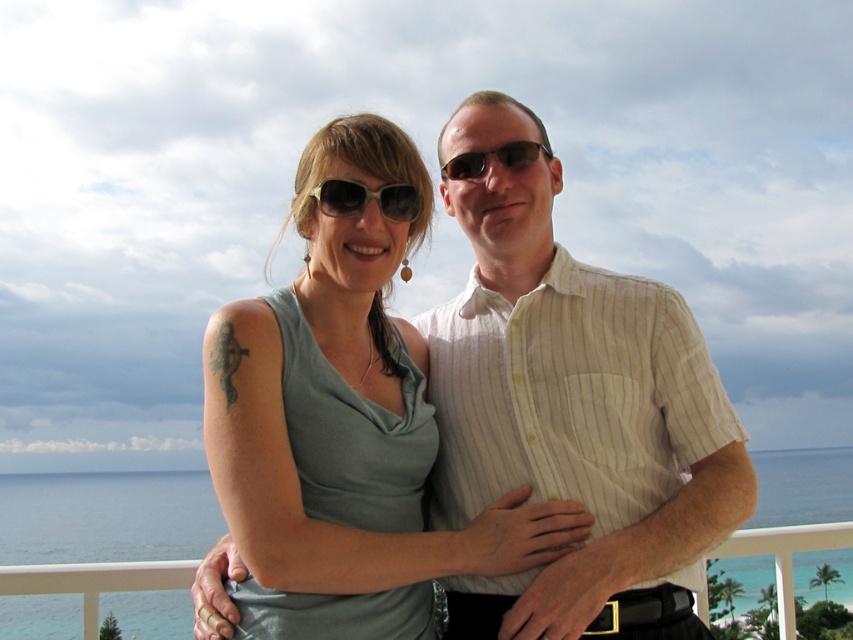
Question: Does matte yellow sunglasses at center have a larger size compared to matte black sunglasses at center?

Choices:
 (A) no
 (B) yes

Answer: (B)

Question: Where is white striped shirt at center located in relation to matte yellow sunglasses at center in the image?

Choices:
 (A) left
 (B) right

Answer: (B)

Question: Does white striped shirt at center have a larger size compared to matte gray tank top at center?

Choices:
 (A) yes
 (B) no

Answer: (A)

Question: Which object is closer to the camera taking this photo?

Choices:
 (A) matte yellow sunglasses at center
 (B) white striped shirt at center
 (C) matte black sunglasses at center

Answer: (B)

Question: Which of the following is the closest to the observer?

Choices:
 (A) matte gray tank top at center
 (B) white striped shirt at center

Answer: (A)

Question: Which object is the closest to the matte black sunglasses at center?

Choices:
 (A) white striped shirt at center
 (B) matte gray tank top at center
 (C) matte yellow sunglasses at center

Answer: (B)